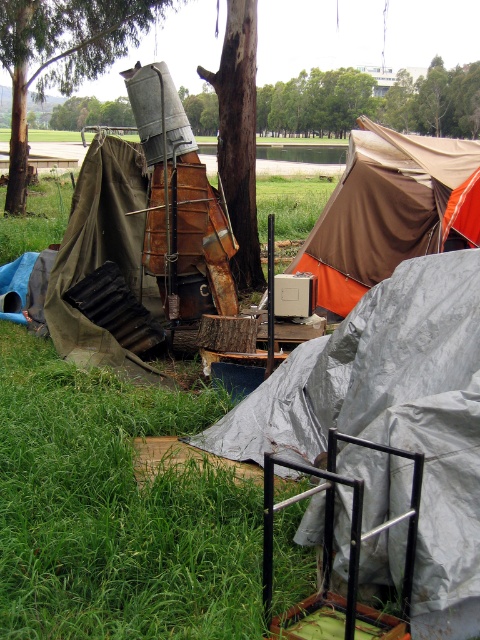
Is brown canvas tent at upper center thinner than brushed metal tree at upper center?

Indeed, brown canvas tent at upper center has a lesser width compared to brushed metal tree at upper center.

Is point (383, 204) farther from viewer compared to point (86, 44)?

No, (383, 204) is closer to viewer.

Is point (391, 202) closer to camera compared to point (23, 52)?

Yes.

Find the location of a particular element. The width and height of the screenshot is (480, 640). brown canvas tent at upper center is located at coordinates pyautogui.click(x=389, y=209).

Can you confirm if silver metallic tent at center is positioned to the right of brushed metal tree at upper center?

Yes, silver metallic tent at center is to the right of brushed metal tree at upper center.

Does point (444, 276) lie behind point (74, 12)?

No, it is in front of (74, 12).

Locate an element on the screen. Image resolution: width=480 pixels, height=640 pixels. silver metallic tent at center is located at coordinates (393, 417).

Who is more distant from viewer, [396,387] or [388,237]?

The point [388,237] is behind.

Is silver metallic tent at center below brown canvas tent at upper center?

Correct, silver metallic tent at center is located below brown canvas tent at upper center.

Where is `silver metallic tent at center`? This screenshot has width=480, height=640. silver metallic tent at center is located at coordinates (393, 417).

Where is `silver metallic tent at center`? The width and height of the screenshot is (480, 640). silver metallic tent at center is located at coordinates (393, 417).